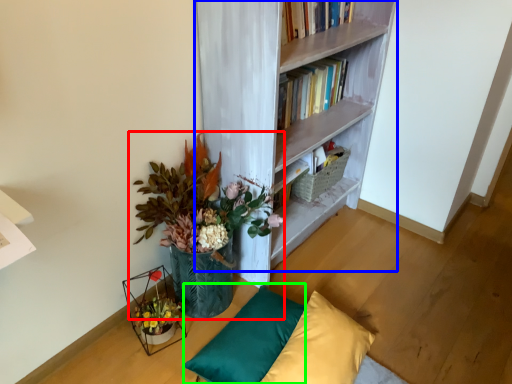
Question: Which object is positioned farthest from houseplant (highlighted by a red box)? Select from bookcase (highlighted by a blue box) and pillow (highlighted by a green box).

Choices:
 (A) bookcase
 (B) pillow

Answer: (B)